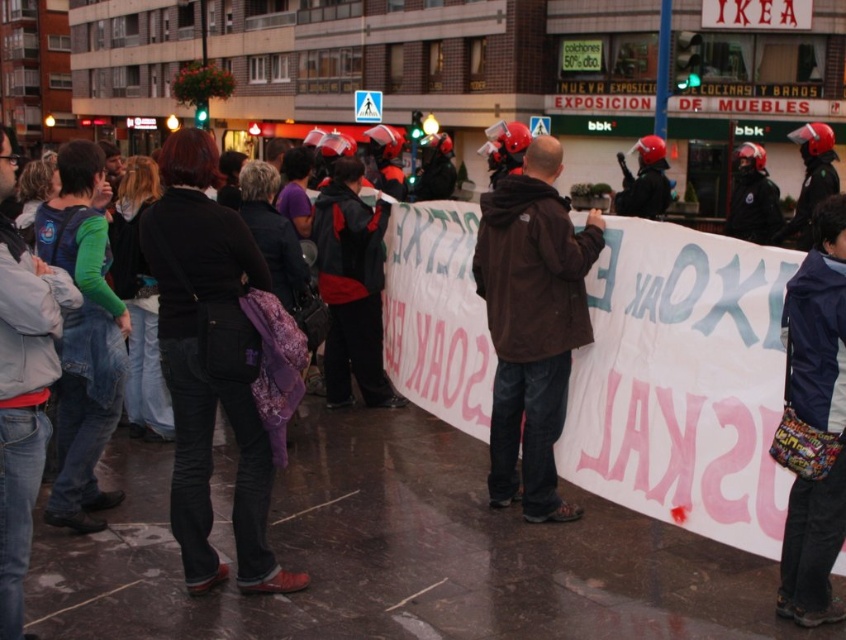
Between point (498, 429) and point (808, 355), which one is positioned behind?

The point (498, 429) is behind.

Who is higher up, brown fabric jacket at center or navy blue fabric jacket at lower right?

Positioned higher is brown fabric jacket at center.

What do you see at coordinates (531, 323) in the screenshot? The image size is (846, 640). I see `brown fabric jacket at center` at bounding box center [531, 323].

Identify the location of brown fabric jacket at center. (531, 323).